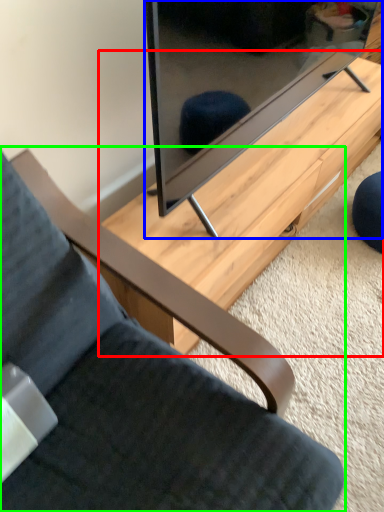
Question: Which object is the farthest from table (highlighted by a red box)? Choose among these: television (highlighted by a blue box) or chair (highlighted by a green box).

Choices:
 (A) television
 (B) chair

Answer: (B)